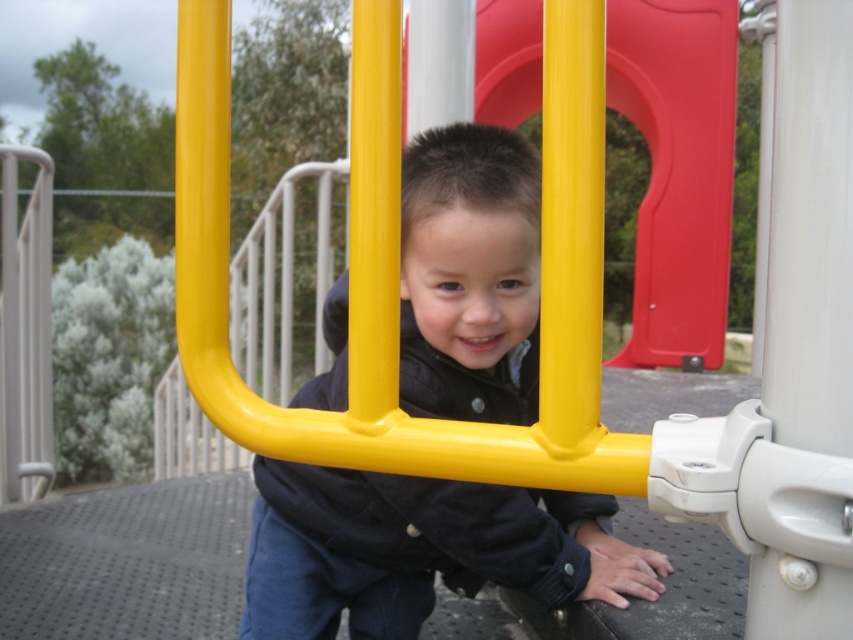
Question: Which of these objects is positioned farthest from the yellow matte pole at center?

Choices:
 (A) smooth plastic slide at center
 (B) matte black jacket at center

Answer: (A)

Question: Can you confirm if matte black jacket at center is bigger than smooth plastic slide at center?

Choices:
 (A) no
 (B) yes

Answer: (A)

Question: Can you confirm if smooth plastic slide at center is positioned to the left of yellow matte pole at center?

Choices:
 (A) no
 (B) yes

Answer: (A)

Question: Among these objects, which one is nearest to the camera?

Choices:
 (A) matte black jacket at center
 (B) smooth plastic slide at center
 (C) yellow matte pole at center

Answer: (C)

Question: Can you confirm if smooth plastic slide at center is bigger than yellow matte pole at center?

Choices:
 (A) yes
 (B) no

Answer: (A)

Question: Which point appears closest to the camera in this image?

Choices:
 (A) pos(489,83)
 (B) pos(412,563)

Answer: (B)